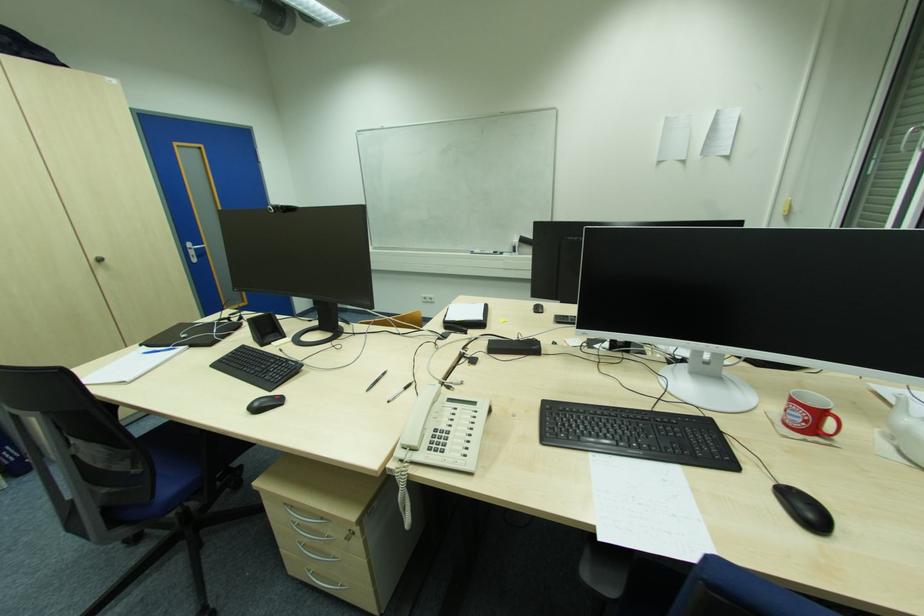
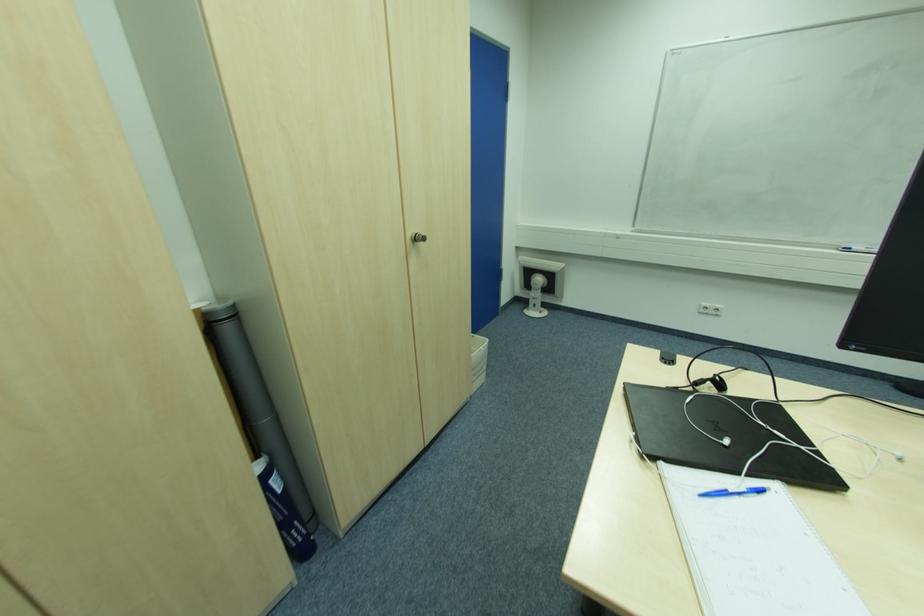
Find the pixel in the second image that matches pixel 187 338 in the first image.

(728, 443)